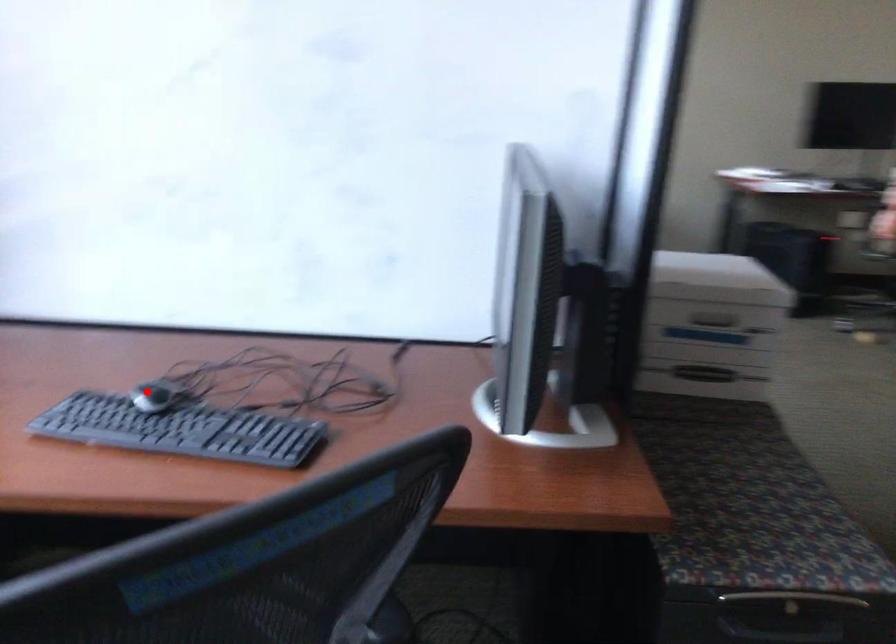
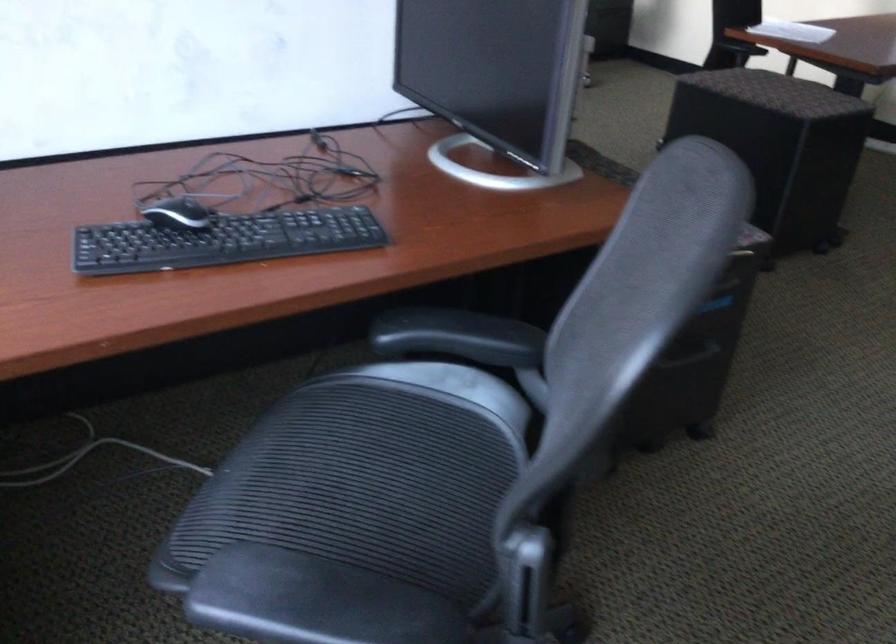
Locate, in the second image, the point that corresponds to the highlighted location in the first image.

(177, 214)